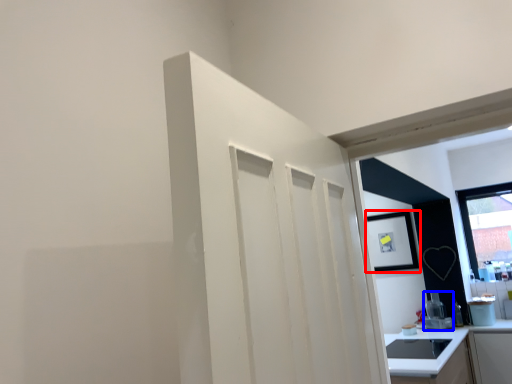
Question: Which point is further to the camera, picture frame (highlighted by a red box) or appliance (highlighted by a blue box)?

Choices:
 (A) picture frame
 (B) appliance

Answer: (A)